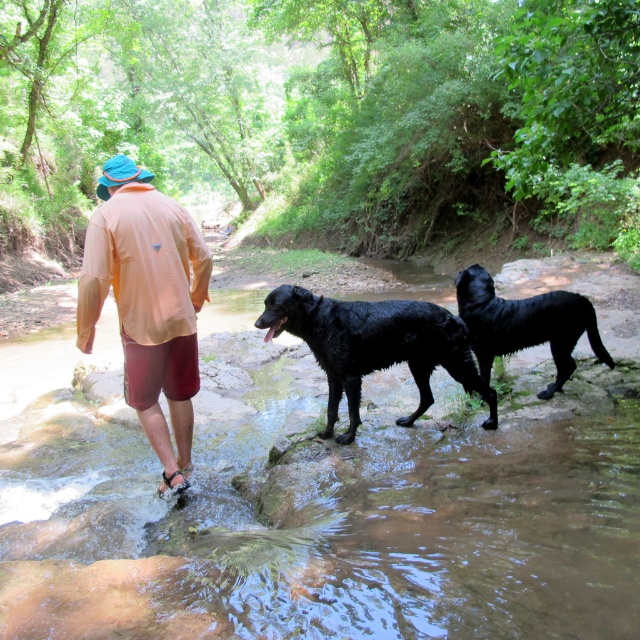
Question: Can you confirm if clear water at stream center is bigger than shiny black dog at center?

Choices:
 (A) no
 (B) yes

Answer: (B)

Question: Considering the real-world distances, which object is farthest from the wet glossy black dog at center?

Choices:
 (A) clear water at stream center
 (B) orange fabric shirt at center
 (C) shiny black dog at center

Answer: (B)

Question: Estimate the real-world distances between objects in this image. Which object is closer to the orange fabric shirt at center?

Choices:
 (A) shiny black dog at center
 (B) clear water at stream center
 (C) wet glossy black dog at center

Answer: (C)

Question: Does clear water at stream center have a greater width compared to shiny black dog at center?

Choices:
 (A) no
 (B) yes

Answer: (B)

Question: Is the position of wet glossy black dog at center more distant than that of shiny black dog at center?

Choices:
 (A) yes
 (B) no

Answer: (B)

Question: Among these points, which one is nearest to the camera?

Choices:
 (A) (531, 337)
 (B) (188, 376)
 (C) (115, 524)

Answer: (C)